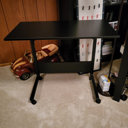
Where is `desk`? desk is located at coordinates (42, 30).